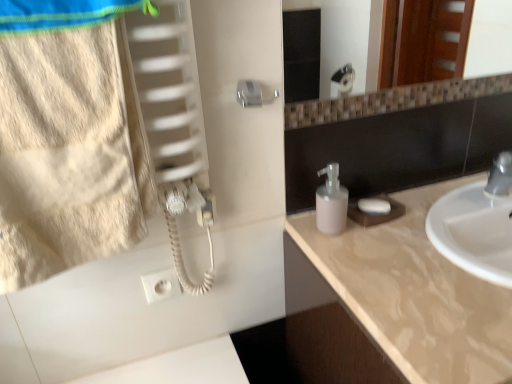
Question: Should I look upward or downward to see beige marble countertop at right?

Choices:
 (A) down
 (B) up

Answer: (A)

Question: From a real-world perspective, is white matte soap at right on pink matte soap dispenser at center?

Choices:
 (A) no
 (B) yes

Answer: (A)

Question: Is white matte soap at right far away from pink matte soap dispenser at center?

Choices:
 (A) no
 (B) yes

Answer: (A)

Question: Is white matte soap at right next to pink matte soap dispenser at center and touching it?

Choices:
 (A) yes
 (B) no

Answer: (B)

Question: Can you confirm if white matte soap at right is thinner than pink matte soap dispenser at center?

Choices:
 (A) no
 (B) yes

Answer: (B)

Question: Does white matte soap at right have a greater width compared to pink matte soap dispenser at center?

Choices:
 (A) yes
 (B) no

Answer: (B)

Question: Is white matte soap at right at the left side of pink matte soap dispenser at center?

Choices:
 (A) yes
 (B) no

Answer: (B)

Question: Is beige cotton towel at left bigger than beige marble countertop at right?

Choices:
 (A) yes
 (B) no

Answer: (B)

Question: Does beige cotton towel at left lie behind beige marble countertop at right?

Choices:
 (A) yes
 (B) no

Answer: (B)

Question: Is beige marble countertop at right at the back of beige cotton towel at left?

Choices:
 (A) yes
 (B) no

Answer: (B)

Question: From the image's perspective, is beige cotton towel at left under beige marble countertop at right?

Choices:
 (A) no
 (B) yes

Answer: (A)

Question: Can you confirm if beige cotton towel at left is positioned to the left of beige marble countertop at right?

Choices:
 (A) no
 (B) yes

Answer: (B)

Question: Is beige cotton towel at left wider than beige marble countertop at right?

Choices:
 (A) yes
 (B) no

Answer: (B)

Question: From a real-world perspective, is white matte soap at right on top of beige cotton towel at left?

Choices:
 (A) no
 (B) yes

Answer: (A)